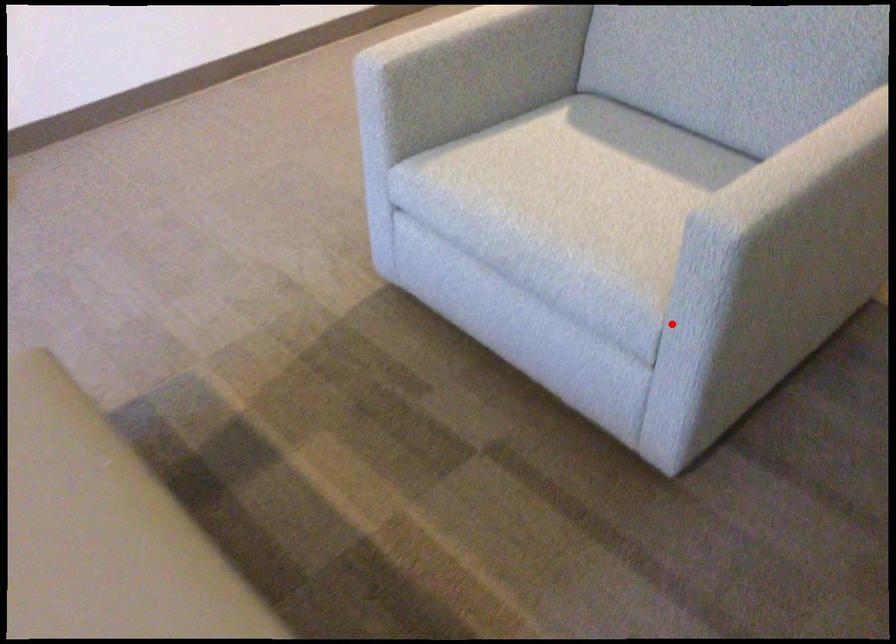
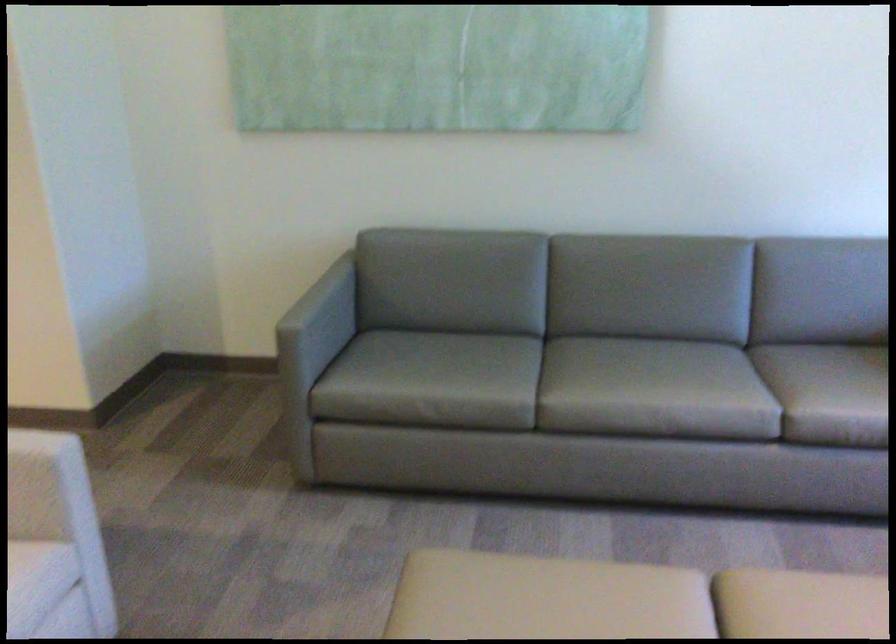
Question: I am providing you with two images of the same scene from different viewpoints. Image1 has a red point marked. In image2, the corresponding 3D location appears at what relative position? Reply with the corresponding letter.

Choices:
 (A) Closer
 (B) Farther

Answer: (B)